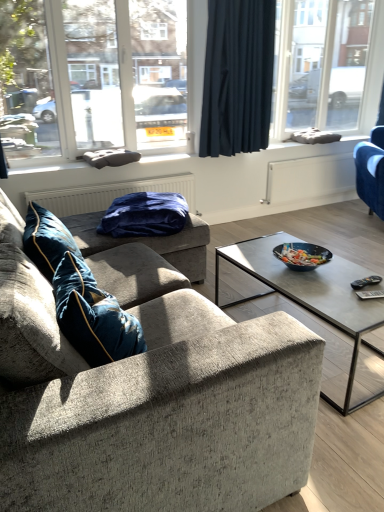
Question: Are dark blue fabric curtain at upper center and blue plush blanket at center, the first pillow positioned from the back, far apart?

Choices:
 (A) no
 (B) yes

Answer: (B)

Question: Can you confirm if dark blue fabric curtain at upper center is smaller than blue plush blanket at center, the first pillow positioned from the back?

Choices:
 (A) no
 (B) yes

Answer: (B)

Question: Can you confirm if dark blue fabric curtain at upper center is bigger than blue plush blanket at center, the first pillow positioned from the back?

Choices:
 (A) yes
 (B) no

Answer: (B)

Question: Is dark blue fabric curtain at upper center taller than blue plush blanket at center, which is the second pillow from front to back?

Choices:
 (A) yes
 (B) no

Answer: (A)

Question: Are dark blue fabric curtain at upper center and blue plush blanket at center, which is the second pillow from front to back, making contact?

Choices:
 (A) yes
 (B) no

Answer: (B)

Question: Could you tell me if dark blue fabric curtain at upper center is turned towards blue plush blanket at center, which is the second pillow from front to back?

Choices:
 (A) yes
 (B) no

Answer: (B)

Question: From the image's perspective, is transparent glass window at upper left, which ranks as the 1th window in front-to-back order, located above velvet blue pillow at left, acting as the second pillow starting from the back?

Choices:
 (A) no
 (B) yes

Answer: (B)

Question: Is there a large distance between transparent glass window at upper left, which is the 2th window in back-to-front order, and velvet blue pillow at left, the first pillow positioned from the front?

Choices:
 (A) yes
 (B) no

Answer: (A)

Question: Is transparent glass window at upper left, which is the 2th window in back-to-front order, not inside velvet blue pillow at left, acting as the second pillow starting from the back?

Choices:
 (A) yes
 (B) no

Answer: (A)

Question: Does transparent glass window at upper left, which ranks as the 1th window in front-to-back order, have a larger size compared to velvet blue pillow at left, acting as the second pillow starting from the back?

Choices:
 (A) no
 (B) yes

Answer: (B)

Question: Is the depth of transparent glass window at upper left, which ranks as the 1th window in front-to-back order, less than that of velvet blue pillow at left, the first pillow positioned from the front?

Choices:
 (A) no
 (B) yes

Answer: (A)

Question: Does transparent glass window at upper left, marked as the first window in a left-to-right arrangement, have a smaller size compared to velvet blue pillow at left, the first pillow positioned from the front?

Choices:
 (A) no
 (B) yes

Answer: (A)

Question: From the image's perspective, would you say transparent glass window at upper right, which appears as the first window when viewed from the right, is positioned over velvet blue armchair at right, which is the 2th studio couch in left-to-right order?

Choices:
 (A) yes
 (B) no

Answer: (A)